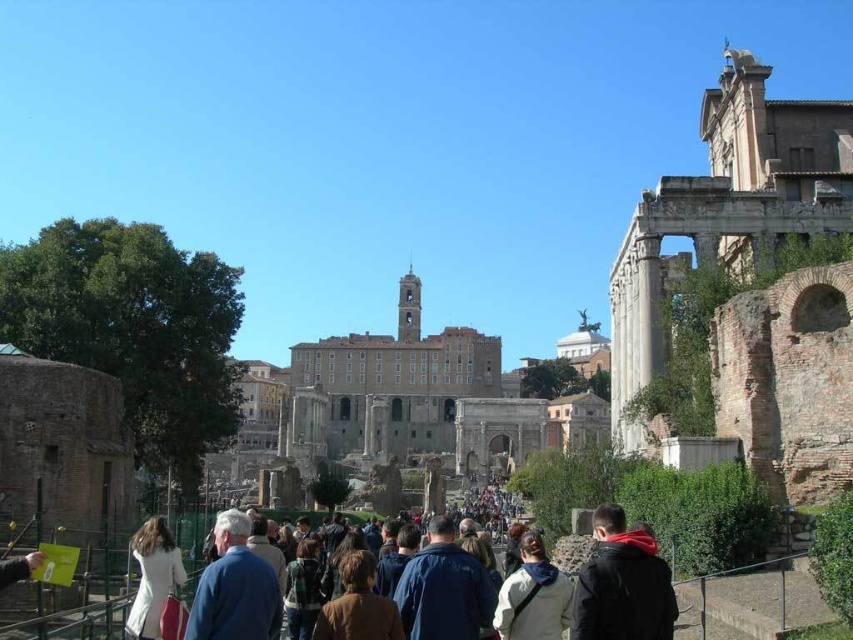
Is dark blue jacket at lower right wider than brown leather jacket at center?

Yes.

Does point (643, 611) come behind point (341, 618)?

That is False.

The height and width of the screenshot is (640, 853). Identify the location of dark blue jacket at lower right. (622, 584).

Who is more forward, (672, 596) or (149, 552)?

Point (672, 596) is more forward.

Consider the image. Is dark blue jacket at center thinner than white matte coat at lower left?

No.

In order to click on dark blue jacket at center in this screenshot , I will do `click(618, 580)`.

From the picture: Does white cotton jacket at center appear on the right side of white matte coat at lower left?

Indeed, white cotton jacket at center is positioned on the right side of white matte coat at lower left.

Can you confirm if white cotton jacket at center is positioned below white matte coat at lower left?

Yes.

This screenshot has height=640, width=853. In order to click on white cotton jacket at center in this screenshot , I will do 532,596.

Where is `white cotton jacket at center`? This screenshot has width=853, height=640. white cotton jacket at center is located at coordinates (532, 596).